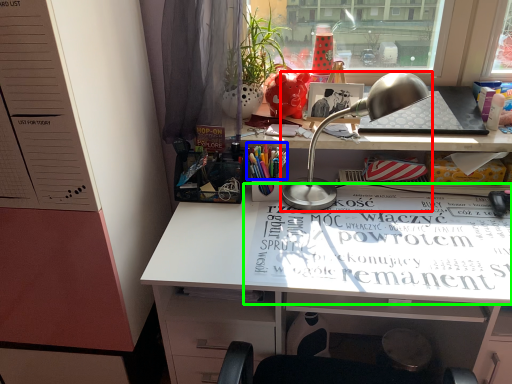
Question: Considering the real-world distances, which object is farthest from lamp (highlighted by a red box)? stationery (highlighted by a blue box) or magazine (highlighted by a green box)?

Choices:
 (A) stationery
 (B) magazine

Answer: (B)